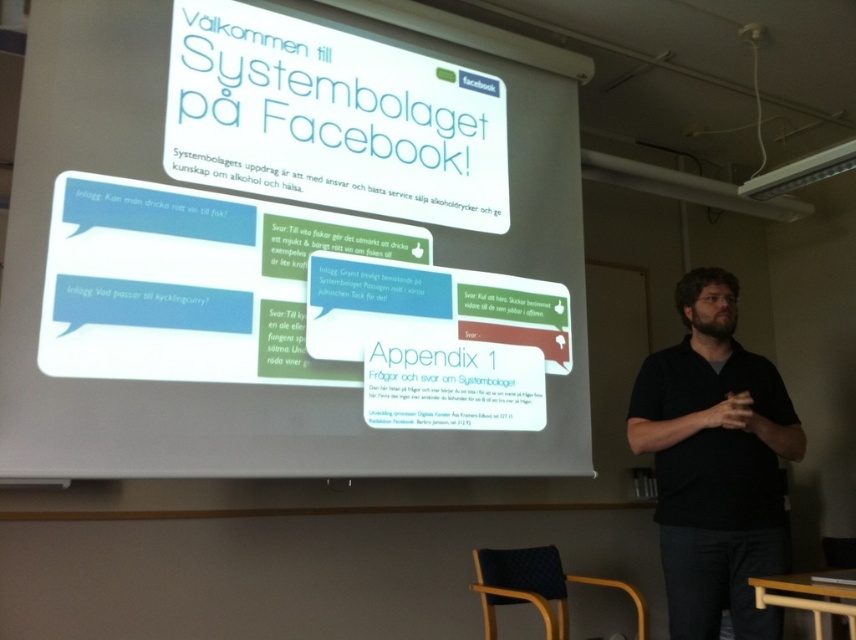
You are an attendee at the presentation and need to take notes. Which object, the white paper at center or the black matte shirt at center, would be easier to see from your seat in the back?

The white paper at center is bigger than the black matte shirt at center, so the white paper at center would be easier to see from the back of the room.

You are a photographer taking a photo of the presentation. You notice two points in the image at coordinates point (43, 182) and point (758, 424). Which point is closer to the camera?

Point (43, 182) is closer to the camera than point (758, 424).